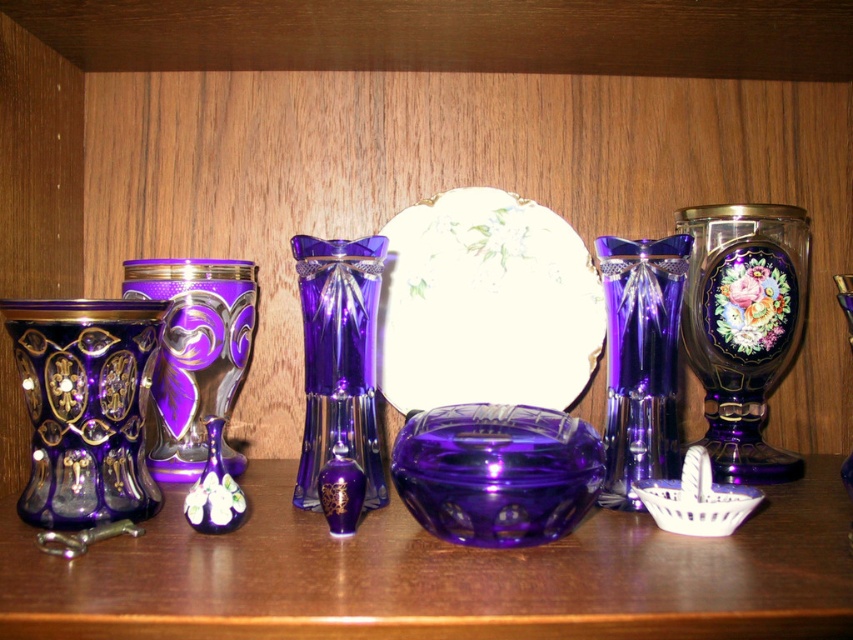
You are an interior designer arranging items on a shelf. You have a transparent purple bowl at center and a transparent purple vase at center. Which one is shorter?

The transparent purple bowl at center is shorter than the transparent purple vase at center.

You are an interior designer arranging items on a shelf. You have a transparent purple bowl at center and a small silver candlestick on the left. The shelf is 30 inches wide. Can both items fit side by side without overlapping?

The transparent purple bowl at center and the small silver candlestick on the left are 22.24 inches apart. Since the shelf is 30 inches wide, there is enough space to fit both items side by side without overlapping.

Based on the photo, you are an interior designer arranging items on a shelf. You have a matte purple glass vase at center and a matte purple vase at center. Which one is more to the right?

The matte purple glass vase at center is positioned on the right side of the matte purple vase at center, so it is more to the right.